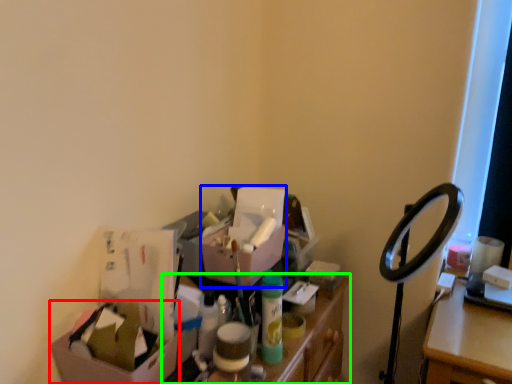
Question: Which is farther away from box (highlighted by a red box)? box (highlighted by a blue box) or furniture (highlighted by a green box)?

Choices:
 (A) box
 (B) furniture

Answer: (A)